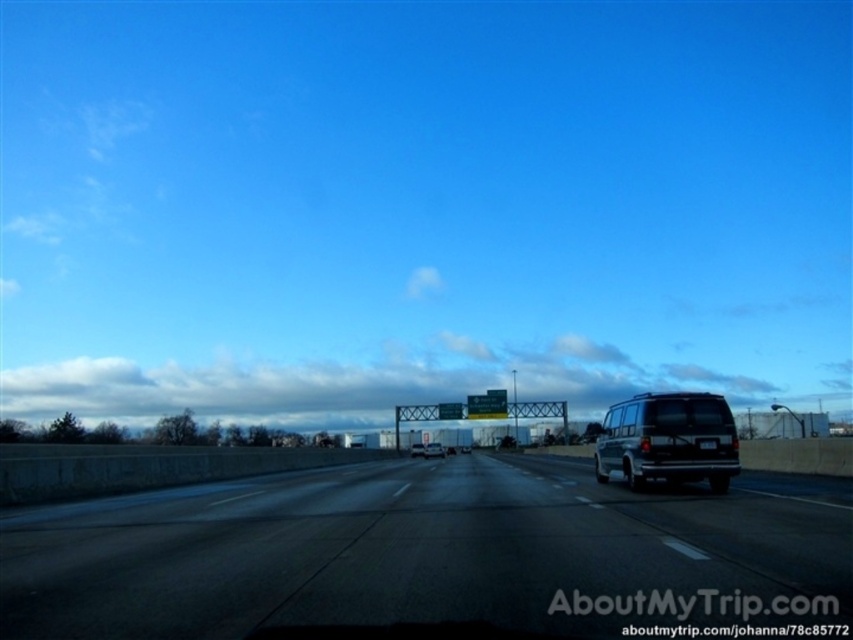
Question: Among these objects, which one is farthest from the camera?

Choices:
 (A) black asphalt highway at center
 (B) silver metallic van at center
 (C) white glossy van at center
 (D) metallic silver van at center

Answer: (D)

Question: Which object appears closest to the camera in this image?

Choices:
 (A) silver metallic van at center
 (B) matte black van at center
 (C) black asphalt highway at center

Answer: (C)

Question: Is the position of matte black van at center more distant than that of white glossy van at center?

Choices:
 (A) no
 (B) yes

Answer: (A)

Question: From the image, what is the correct spatial relationship of black asphalt highway at center in relation to silver metallic van at center?

Choices:
 (A) above
 (B) below

Answer: (B)

Question: Does matte black van at center lie in front of metallic silver van at center?

Choices:
 (A) yes
 (B) no

Answer: (A)

Question: Which point is farther to the camera?

Choices:
 (A) matte black van at center
 (B) metallic silver van at center
 (C) silver metallic van at center

Answer: (B)